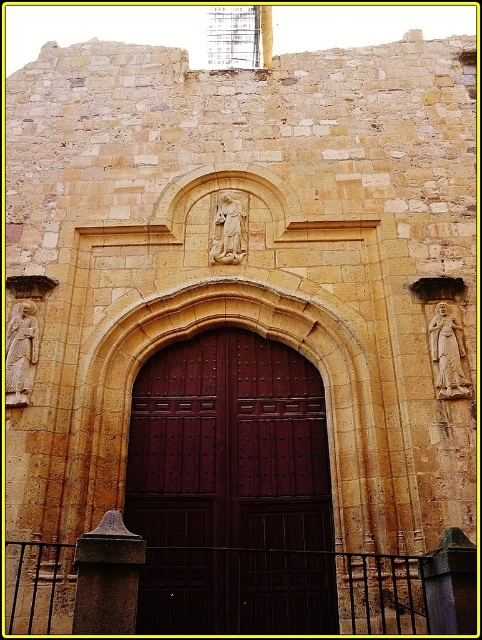
You are an architect planning to install a new security camera. The camera needs to be placed at a height that can cover both the dark wood door at center and the white stone statue at right. Given their sizes, which object should the camera be positioned closer to?

The dark wood door at center is larger than the white stone statue at right, so the camera should be positioned closer to the white stone statue at right to ensure both are within the camera view.

You are standing in front of the historic stone building and want to locate the white stone statue at left. Based on the coordinates provided in the description, can you determine its position relative to the central doorway?

The white stone statue at left is located at point coordinates that are closer to the bottom of the image compared to the central doorway, meaning it is positioned lower down on the facade, likely near the base of the structure.

You are an architect visiting the historic stone building. You notice two statues, the white stone statue at left and the white stone statue at right. From your vantage point, which statue appears closer to you?

The white stone statue at left appears closer because it is in front of the white stone statue at right.